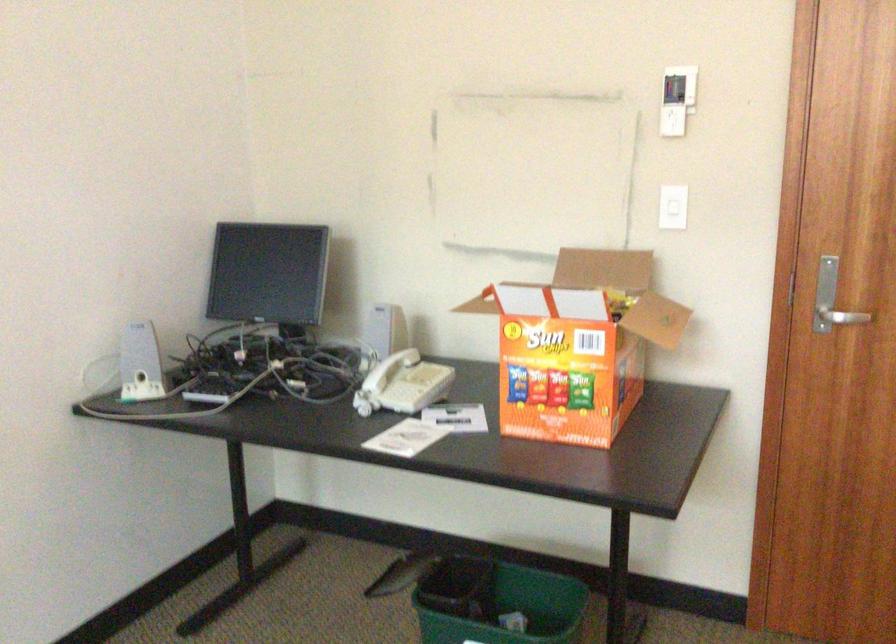
This screenshot has height=644, width=896. I want to click on white telephone handset, so click(376, 383).